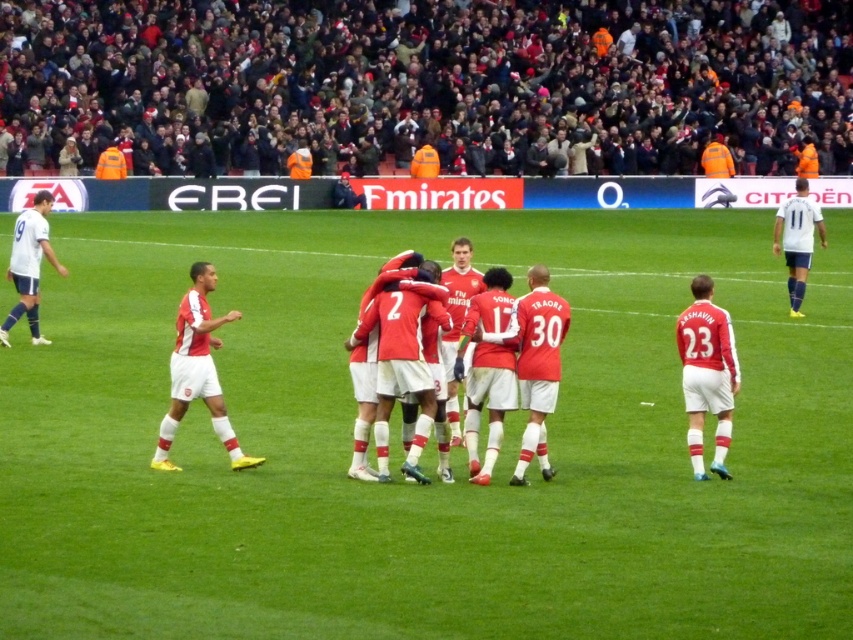
You are a soccer coach analyzing the field positions. You see two points marked on the field. The first point is at coordinate point(x=100, y=492) and the second point is at coordinate point(x=212, y=268). Based on the scene, which point is closer to the red team celebrating?

Point(x=100, y=492) is in front of point(x=212, y=268), so it is closer to the red team celebrating.

You are a soccer referee standing at the center circle and see the matte red jersey at right and the matte white shorts at left. Which object is closer to you?

The matte red jersey at right is positioned under the matte white shorts at left, meaning it is closer to you since it is in front spatially.

You are a photographer positioned at the center of the soccer field. You want to take a photo of the dark gray fabric crowd at upper center and the matte red jersey at right. Which object should you pan your camera to the right to capture?

The matte red jersey at right is to the right of the dark gray fabric crowd at upper center, so you should pan your camera to the right to capture the matte red jersey at right.